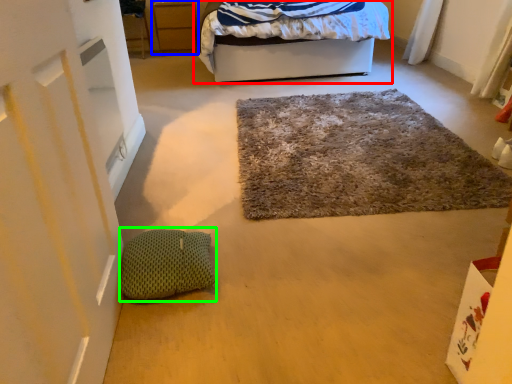
Question: Considering the real-world distances, which object is farthest from bed (highlighted by a red box)? cabinetry (highlighted by a blue box) or pillow (highlighted by a green box)?

Choices:
 (A) cabinetry
 (B) pillow

Answer: (B)